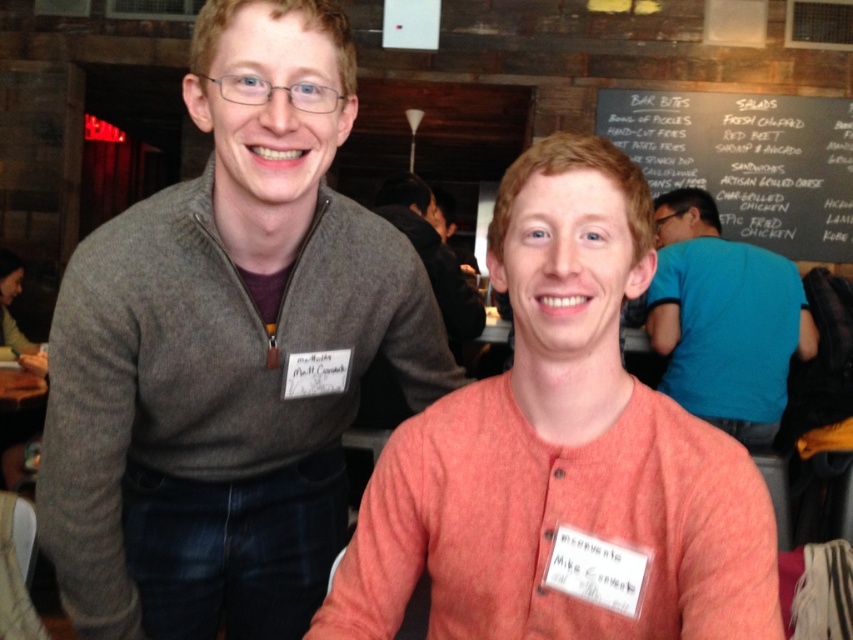
Between matte gray sweater at left and blue cotton shirt at right, which one has less height?

Standing shorter between the two is blue cotton shirt at right.

Which is more to the left, matte gray sweater at left or blue cotton shirt at right?

Positioned to the left is matte gray sweater at left.

Looking at this image, measure the distance between matte gray sweater at left and camera.

They are 1.01 meters apart.

At what (x,y) coordinates should I click in order to perform the action: click on matte gray sweater at left. Please return your answer as a coordinate pair (x, y). The image size is (853, 640). Looking at the image, I should click on (228, 353).

Between point (833, 248) and point (747, 304), which one is positioned behind?

The point (833, 248) is behind.

Between point (775, 195) and point (757, 317), which one is positioned in front?

Point (757, 317) is in front.

Where is `black chalkboard at upper right`? black chalkboard at upper right is located at coordinates (746, 161).

Does matte orange shirt at center have a greater height compared to matte gray sweater at center?

Incorrect, matte orange shirt at center's height is not larger of matte gray sweater at center's.

Which is in front, point (436, 408) or point (462, 332)?

Positioned in front is point (436, 408).

Which is behind, point (538, 285) or point (465, 305)?

The point (465, 305) is more distant.

Identify the location of matte orange shirt at center. Image resolution: width=853 pixels, height=640 pixels. (561, 456).